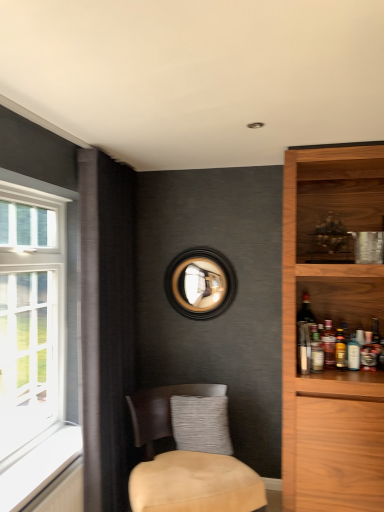
Question: In terms of width, does translucent glass bottle at shelf right, acting as the second beverage starting from the left, look wider or thinner when compared to translucent glass bottle at shelf right, the fourth beverage from the left?

Choices:
 (A) thin
 (B) wide

Answer: (B)

Question: Does point (327, 362) appear closer or farther from the camera than point (372, 361)?

Choices:
 (A) farther
 (B) closer

Answer: (B)

Question: Estimate the real-world distances between objects in this image. Which object is farther from the translucent glass bottle at shelf right, the first beverage positioned from the right?

Choices:
 (A) translucent glass bottle at shelf right, acting as the second beverage starting from the left
 (B) white plastic bottle at shelf right, the 2th beverage when ordered from right to left
 (C) translucent glass bottle at shelf right, placed as the first beverage when sorted from left to right
 (D) gray textured pillow at center
 (E) black wood picture frame at center

Answer: (E)

Question: Which is nearer to the white plastic bottle at shelf right, which is counted as the third beverage, starting from the left?

Choices:
 (A) translucent glass bottle at shelf right, the fourth beverage from the left
 (B) translucent glass bottle at shelf right, placed as the first beverage when sorted from left to right
 (C) beige fabric chair at lower center
 (D) black wood picture frame at center
 (E) gray textured pillow at center

Answer: (A)